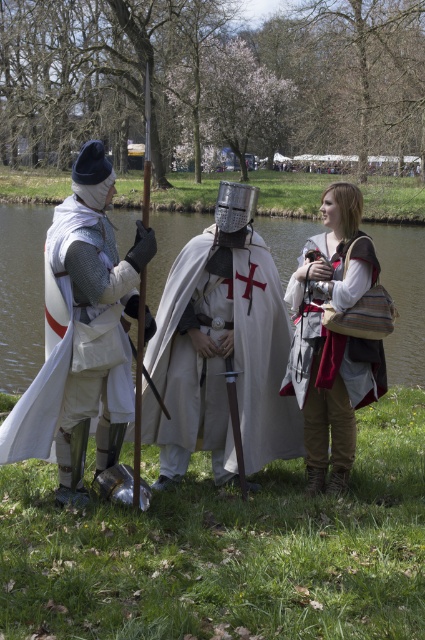
Question: From the image, what is the correct spatial relationship of white matte cape at center in relation to matte white tunic at center?

Choices:
 (A) right
 (B) left

Answer: (B)

Question: Which object appears farthest from the camera in this image?

Choices:
 (A) white matte cape at center
 (B) white cloth cape at center
 (C) white chainmail armor at left
 (D) matte white tunic at center

Answer: (B)

Question: Which object is positioned closest to the white matte cape at center?

Choices:
 (A) white chainmail armor at left
 (B) white cloth cape at center
 (C) matte white tunic at center

Answer: (C)

Question: Based on their relative distances, which object is nearer to the white chainmail armor at left?

Choices:
 (A) white matte cape at center
 (B) matte white tunic at center
 (C) white cloth cape at center

Answer: (A)

Question: Considering the relative positions of matte white tunic at center and white chainmail armor at left in the image provided, where is matte white tunic at center located with respect to white chainmail armor at left?

Choices:
 (A) left
 (B) right

Answer: (B)

Question: Does white cloth cape at center lie in front of white chainmail armor at left?

Choices:
 (A) yes
 (B) no

Answer: (B)